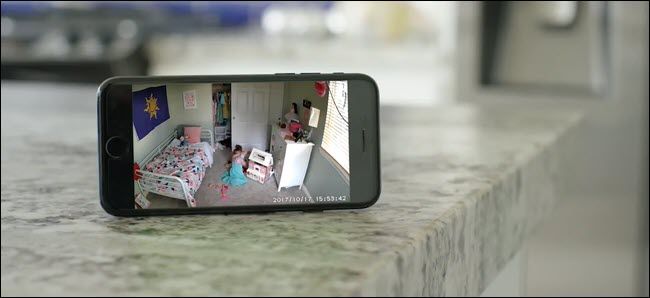
I want to click on dresser, so click(x=298, y=161).